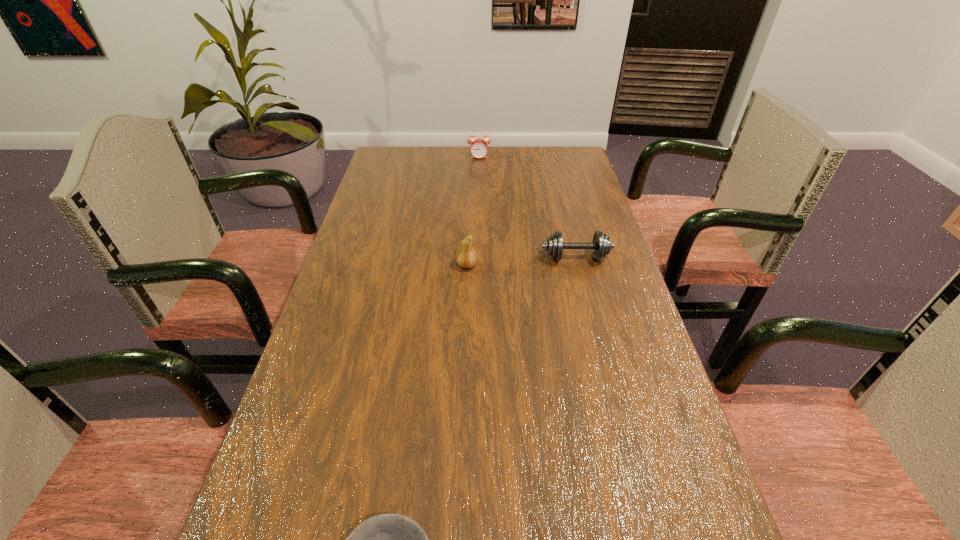
Find the location of a particular element. This screenshot has width=960, height=540. alarm clock is located at coordinates (479, 148).

Locate an element on the screen. This screenshot has width=960, height=540. pear is located at coordinates (466, 257).

Locate an element on the screen. Image resolution: width=960 pixels, height=540 pixels. dumbbell is located at coordinates (601, 245).

Locate an element on the screen. vacant space located on the clock face of the alarm clock is located at coordinates (479, 187).

Find the location of a particular element. Image resolution: width=960 pixels, height=540 pixels. vacant region located on the back of the pear is located at coordinates (469, 199).

Locate an element on the screen. free spot located 0.150m on the left of the rightmost object is located at coordinates (486, 258).

Where is `object located at the far edge`? This screenshot has width=960, height=540. object located at the far edge is located at coordinates (479, 148).

The height and width of the screenshot is (540, 960). In order to click on object positioned at the right edge in this screenshot , I will do `click(601, 245)`.

In the image, there is a desktop. At what (x,y) coordinates should I click in order to perform the action: click on vacant space at the far edge. Please return your answer as a coordinate pair (x, y). This screenshot has height=540, width=960. Looking at the image, I should click on (435, 166).

Identify the location of free region at the left edge of the desktop. The width and height of the screenshot is (960, 540). (308, 430).